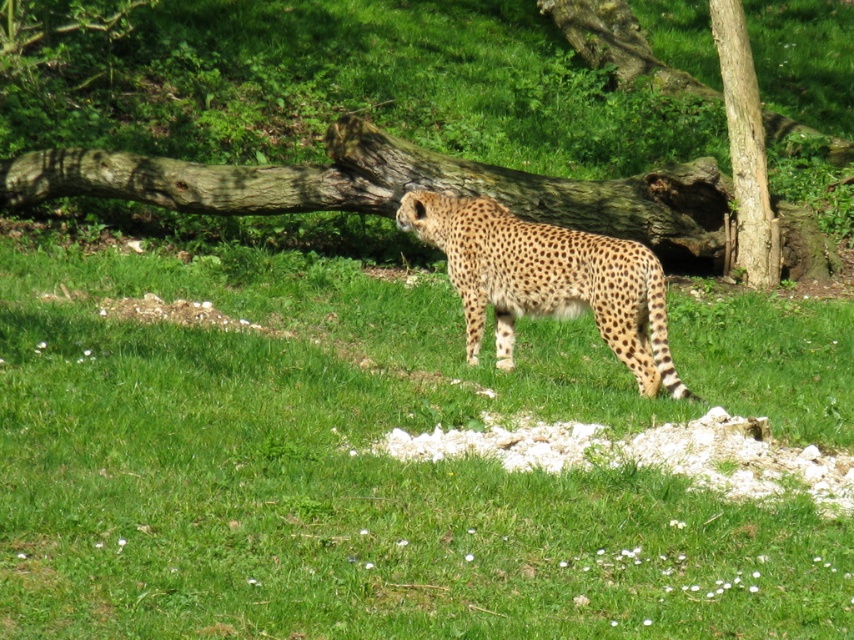
Question: From the image, what is the correct spatial relationship of green grassy at center in relation to brown rough bark tree at right?

Choices:
 (A) below
 (B) above

Answer: (A)

Question: Which is farther from the spotted fur cheetah at center?

Choices:
 (A) green grassy at center
 (B) brown rough bark tree at right

Answer: (B)

Question: In this image, where is green grassy at center located relative to brown rough bark tree at right?

Choices:
 (A) above
 (B) below

Answer: (B)

Question: Which point is farther to the camera?

Choices:
 (A) spotted fur cheetah at center
 (B) brown rough bark tree at right

Answer: (B)

Question: Considering the relative positions of spotted fur cheetah at center and brown rough bark tree at right in the image provided, where is spotted fur cheetah at center located with respect to brown rough bark tree at right?

Choices:
 (A) below
 (B) above

Answer: (A)

Question: Among these points, which one is farthest from the camera?

Choices:
 (A) (732, 68)
 (B) (823, 340)

Answer: (A)